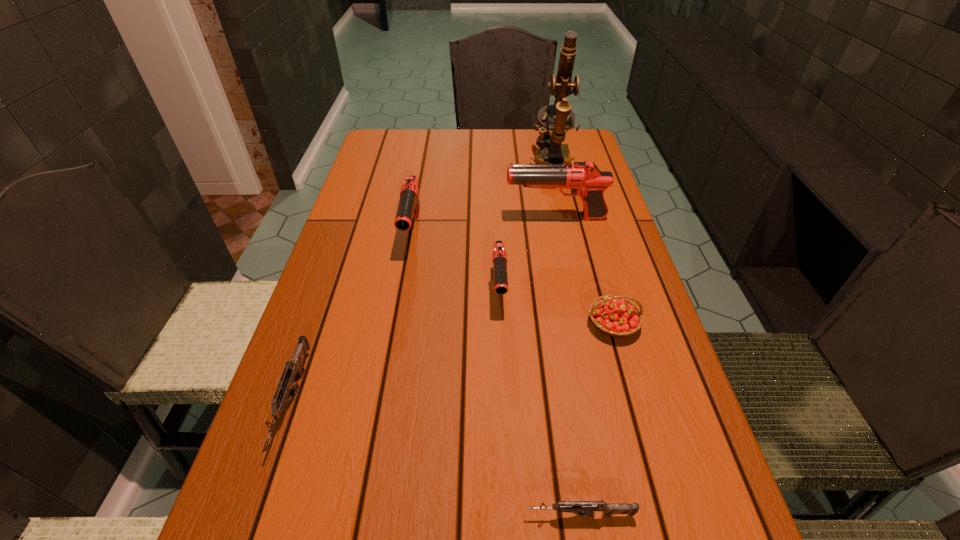
Image resolution: width=960 pixels, height=540 pixels. Find the location of `the leftmost gun`. the leftmost gun is located at coordinates (295, 366).

Image resolution: width=960 pixels, height=540 pixels. Find the location of `the leftmost object`. the leftmost object is located at coordinates (295, 366).

Locate an element on the screen. the shortest gun is located at coordinates (582, 508).

At what (x,y) coordinates should I click in order to perform the action: click on the nearer grey gun. Please return your answer as a coordinate pair (x, y). Image resolution: width=960 pixels, height=540 pixels. Looking at the image, I should click on (582, 508).

At what (x,y) coordinates should I click in order to perform the action: click on vacant point located 0.270m on the front of the tallest object. Please return your answer as a coordinate pair (x, y). Looking at the image, I should click on click(568, 234).

Where is `vacant region located 0.260m at the aiming end of the tallest gun`? vacant region located 0.260m at the aiming end of the tallest gun is located at coordinates (409, 218).

Find the location of a particular element. This screenshot has width=960, height=540. free location located at the aiming end of the tallest gun is located at coordinates (461, 218).

Identify the location of vacant area situated 0.120m at the aiming end of the tallest gun. The width and height of the screenshot is (960, 540). (461, 218).

Where is `vacant space located at the aiming end of the fifth shortest object`? The width and height of the screenshot is (960, 540). vacant space located at the aiming end of the fifth shortest object is located at coordinates (396, 324).

Locate an element on the screen. Image resolution: width=960 pixels, height=540 pixels. vacant space located at the aiming end of the third gun from right to left is located at coordinates [501, 335].